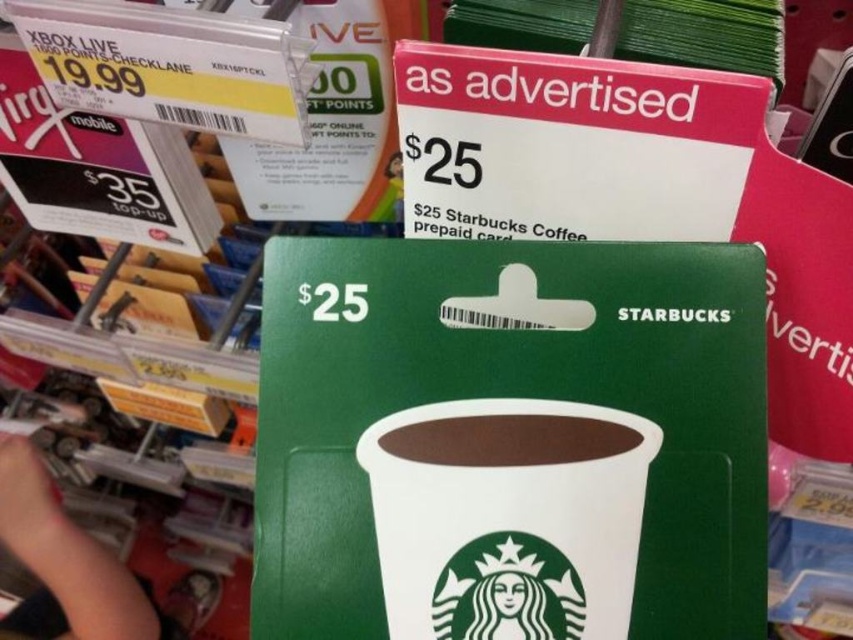
Based on the photo, you are a customer in a store looking for the Starbucks gift card. Where exactly is the green matte starbucks prepaid card at center located in the image?

The green matte starbucks prepaid card at center is located at point [509,440] in the image.

You are a customer in a store and you see both the white paper cup at center and the brown matte cup at center. Which cup is placed below the other?

The white paper cup at center is positioned under brown matte cup at center, so the white one is below the brown one.

You are a cashier at the store and need to place the green matte Starbucks prepaid card at center and the white paper cup at center into a vertical display stand that can only accommodate items up to 12 inches in height. Given their height relationship, which item might not fit if the taller one is already placed?

The green matte Starbucks prepaid card at center is taller than the white paper cup at center. If the taller item, the green matte Starbucks prepaid card at center, is placed first, it might exceed the 12 inches height limit of the display stand, leaving no space for the shorter item.